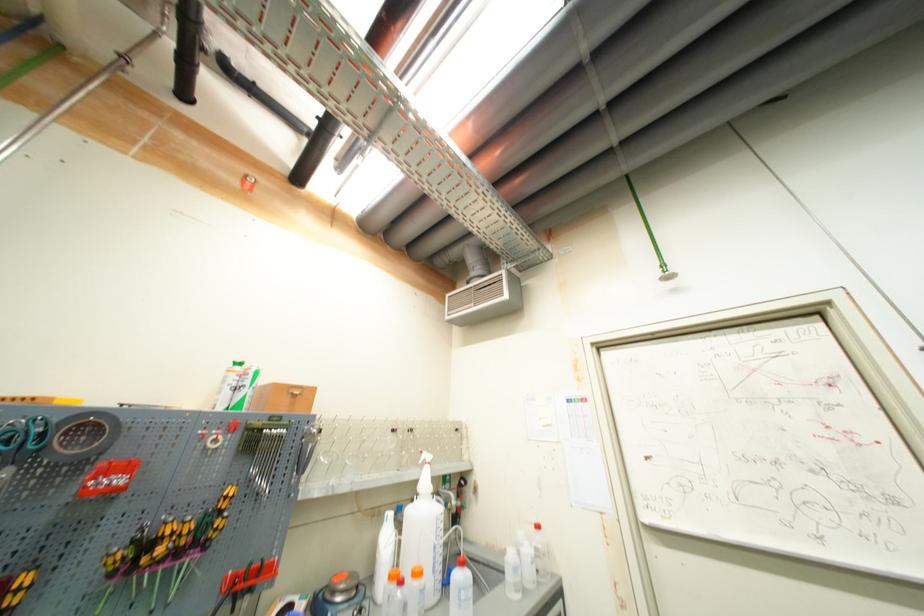
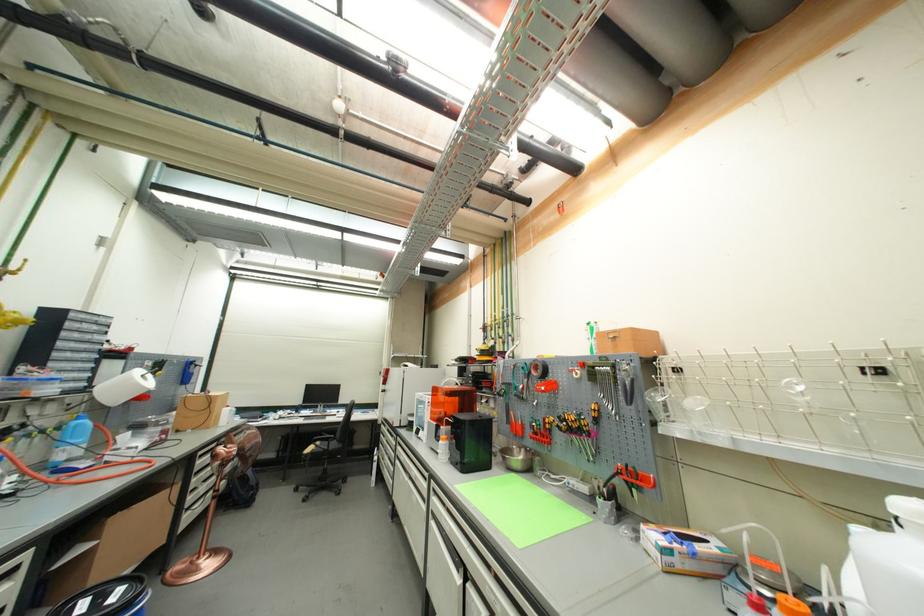
Where in the second image is the point corresponding to [103,487] from the first image?

(544, 390)